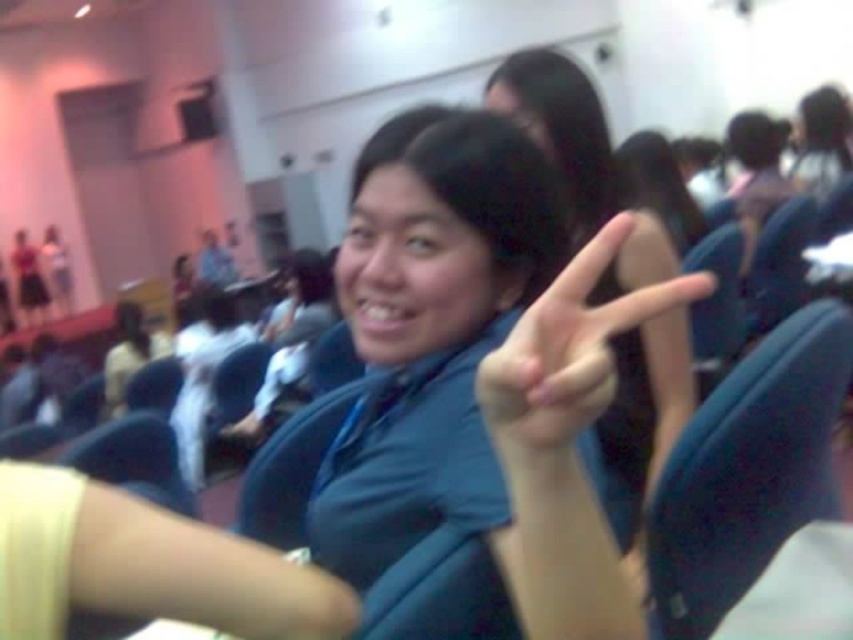
Is blue fabric shirt at center taller than matte blue shirt at center?

Yes, blue fabric shirt at center is taller than matte blue shirt at center.

Who is positioned more to the right, blue fabric shirt at center or matte blue shirt at center?

blue fabric shirt at center is more to the right.

Where is `blue fabric shirt at center`? blue fabric shirt at center is located at coordinates (480, 372).

Who is higher up, blue fabric shirt at center or blue fabric chair at right?

blue fabric shirt at center is higher up.

What do you see at coordinates (480, 372) in the screenshot?
I see `blue fabric shirt at center` at bounding box center [480, 372].

Locate an element on the screen. Image resolution: width=853 pixels, height=640 pixels. blue fabric shirt at center is located at coordinates (480, 372).

Which of these two, blue fabric chair at right or matte blue shirt at center, stands taller?

blue fabric chair at right

Is blue fabric chair at right further to the viewer compared to matte blue shirt at center?

Yes, blue fabric chair at right is further from the viewer.

Describe the element at coordinates (747, 470) in the screenshot. This screenshot has width=853, height=640. I see `blue fabric chair at right` at that location.

Where is `blue fabric chair at right`? The width and height of the screenshot is (853, 640). blue fabric chair at right is located at coordinates (747, 470).